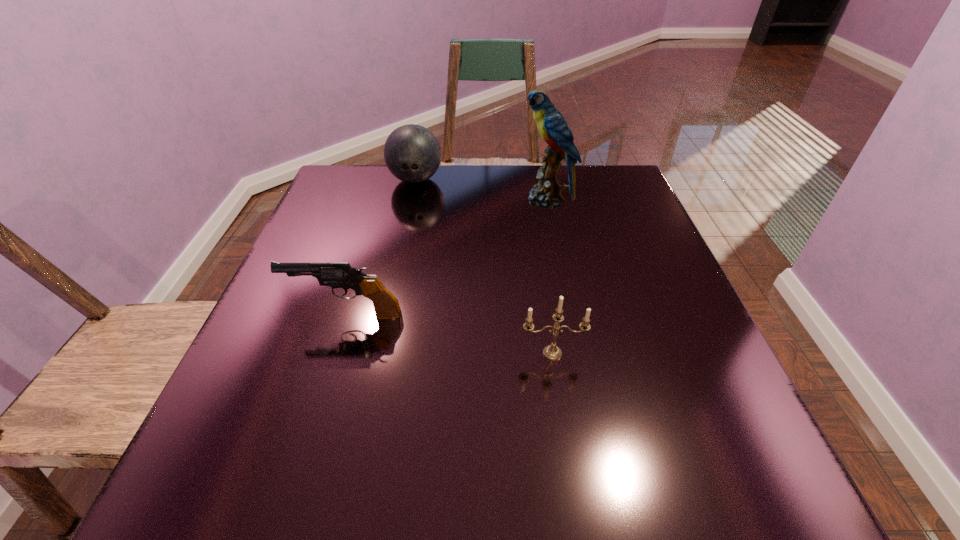
What are the coordinates of `parrot` in the screenshot? It's located at (553, 128).

Where is `bowling ball`? The image size is (960, 540). bowling ball is located at coordinates (412, 153).

This screenshot has height=540, width=960. In order to click on the nearest object in this screenshot , I will do `click(551, 352)`.

The image size is (960, 540). I want to click on the third farthest object, so click(x=334, y=274).

Identify the location of vacant point located 0.340m on the face of the tallest object. Image resolution: width=960 pixels, height=540 pixels. (392, 200).

Find the location of `vacant space situated 0.260m on the face of the tallest object`. vacant space situated 0.260m on the face of the tallest object is located at coordinates (421, 200).

This screenshot has height=540, width=960. Identify the location of vacant space situated on the face of the tallest object. (437, 200).

You are a GUI agent. You are given a task and a screenshot of the screen. Output one action in this format:
    pyautogui.click(x=<x>, y=<y>)
    Task: Click on the vacant region located 0.300m on the grip area of the bowling ball
    Image resolution: width=960 pixels, height=540 pixels.
    Given the screenshot: What is the action you would take?
    pyautogui.click(x=396, y=267)

Identify the location of vacant position located 0.280m on the back of the candle. The width and height of the screenshot is (960, 540). (537, 249).

Identify the location of parrot positioned at the far edge. (553, 128).